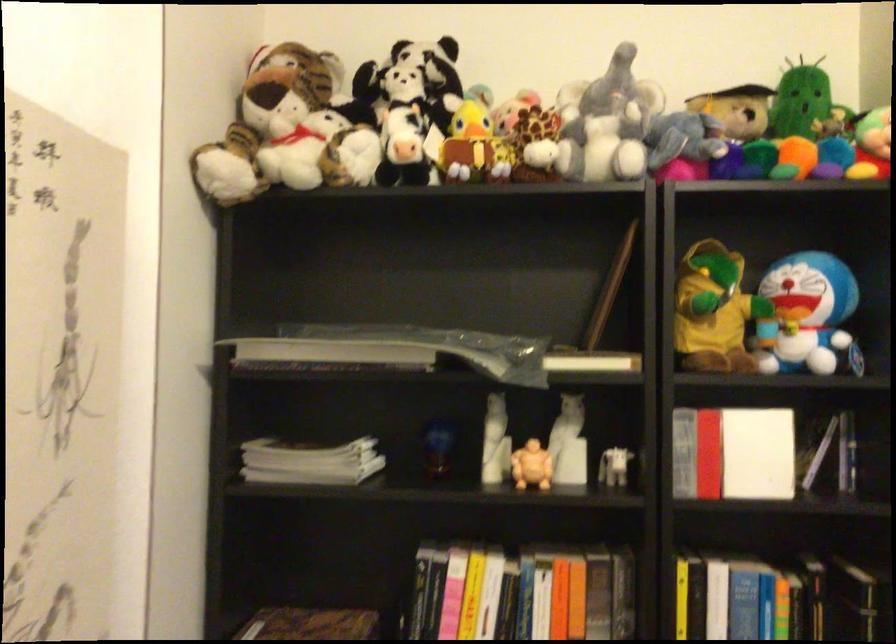
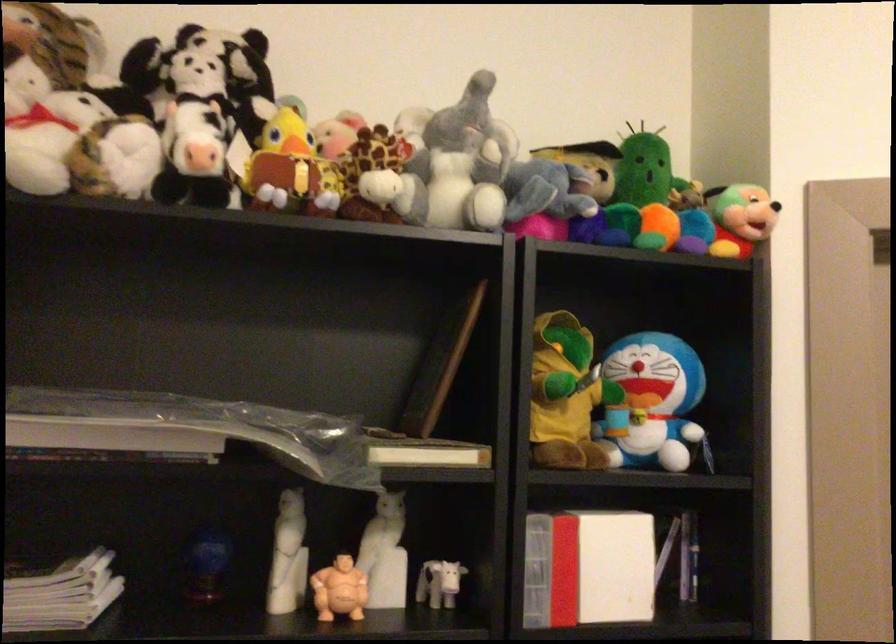
Find the pixel in the second image that matches point (609, 126) in the first image.

(459, 165)